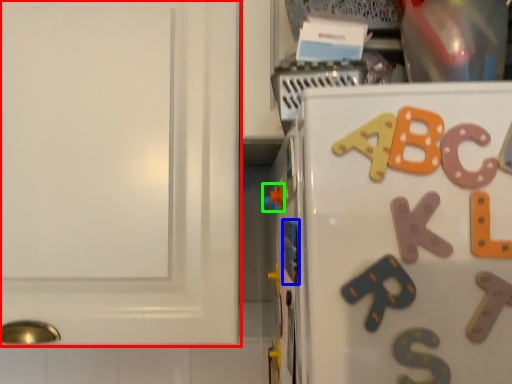
Question: Based on their relative distances, which object is farther from cabinetry (highlighted by a red box)? Choose from magnet (highlighted by a blue box) and toy (highlighted by a green box).

Choices:
 (A) magnet
 (B) toy

Answer: (A)